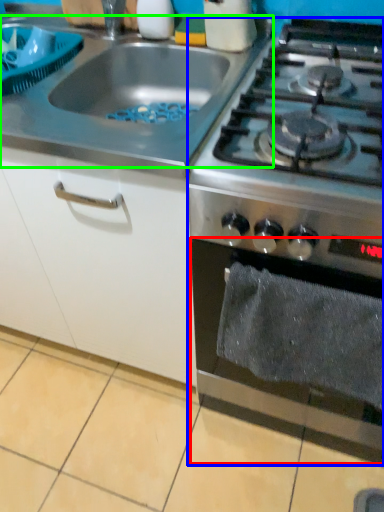
Question: Based on their relative distances, which object is nearer to oven (highlighted by a red box)? Choose from gas stove (highlighted by a blue box) and gas stove (highlighted by a green box).

Choices:
 (A) gas stove
 (B) gas stove

Answer: (A)